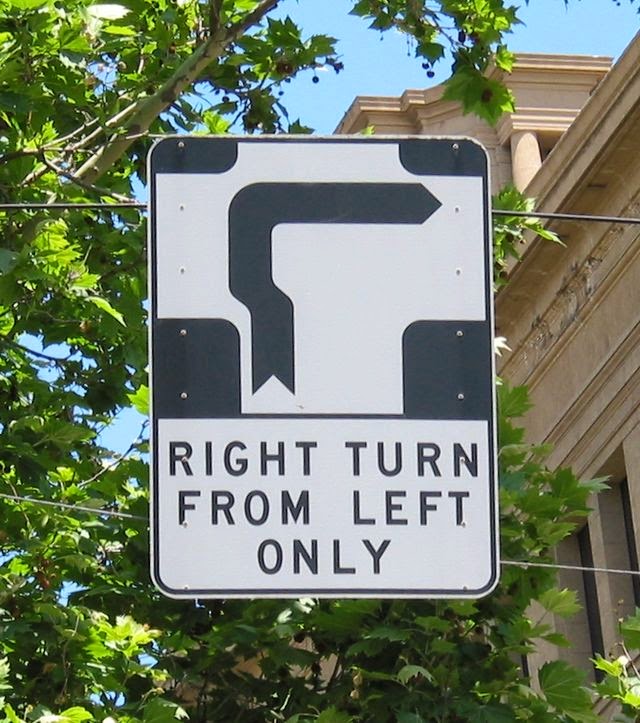
The height and width of the screenshot is (723, 640). I want to click on window, so click(x=589, y=604).